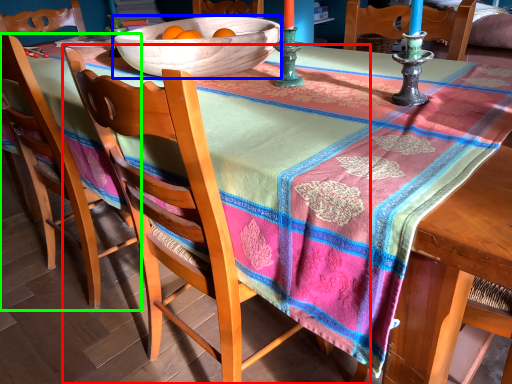
Question: Which object is the closest to the chair (highlighted by a red box)? Choose among these: bowl (highlighted by a blue box) or chair (highlighted by a green box).

Choices:
 (A) bowl
 (B) chair

Answer: (A)